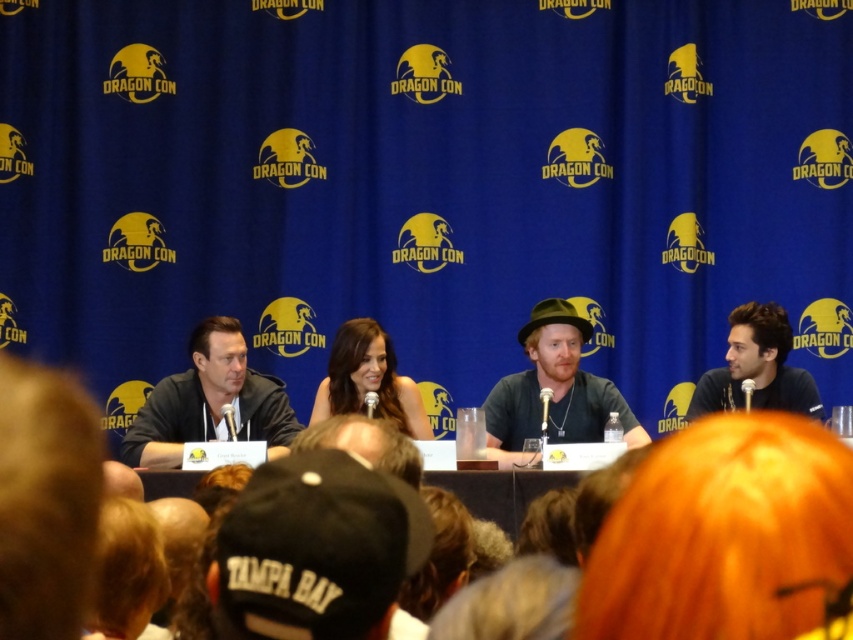
Question: Which object is the farthest from the dark brown hair at right?

Choices:
 (A) smooth brown hair at center
 (B) black leather jacket at left

Answer: (B)

Question: Considering the relative positions of matte black hat at center and dark brown hair at right in the image provided, where is matte black hat at center located with respect to dark brown hair at right?

Choices:
 (A) below
 (B) above

Answer: (A)

Question: Which point is closer to the camera?

Choices:
 (A) (399, 428)
 (B) (537, 362)
 (C) (730, 385)
 (D) (234, 353)

Answer: (D)

Question: Does black leather jacket at left appear over smooth brown hair at center?

Choices:
 (A) no
 (B) yes

Answer: (A)

Question: Is black leather jacket at left below smooth brown hair at center?

Choices:
 (A) yes
 (B) no

Answer: (A)

Question: Estimate the real-world distances between objects in this image. Which object is closer to the black leather jacket at left?

Choices:
 (A) dark brown hair at right
 (B) smooth brown hair at center
 (C) matte black hat at center

Answer: (B)